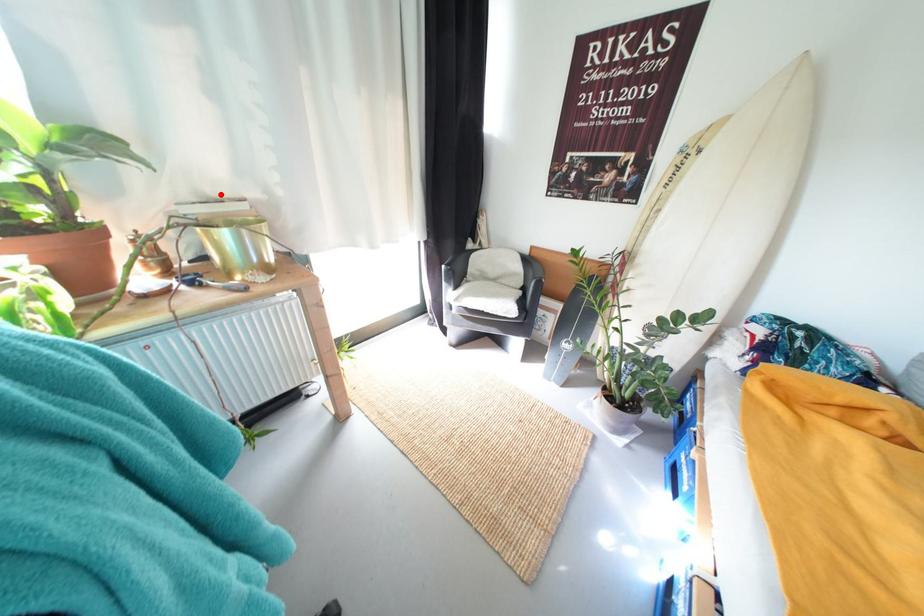
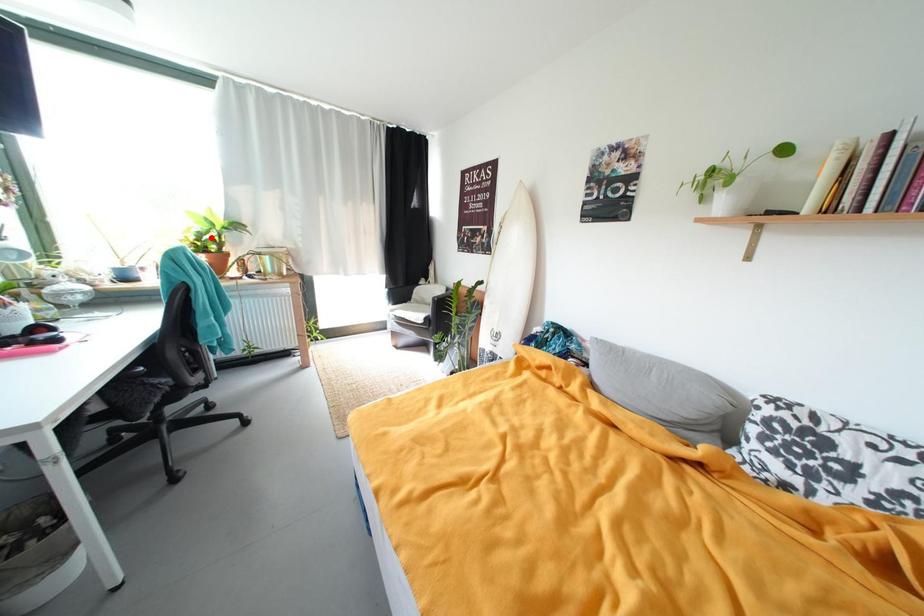
I am providing you with two images of the same scene from different viewpoints. A red point is marked on the first image and another point is marked on the second image. Is the marked point in image1 the same physical position as the marked point in image2?

No